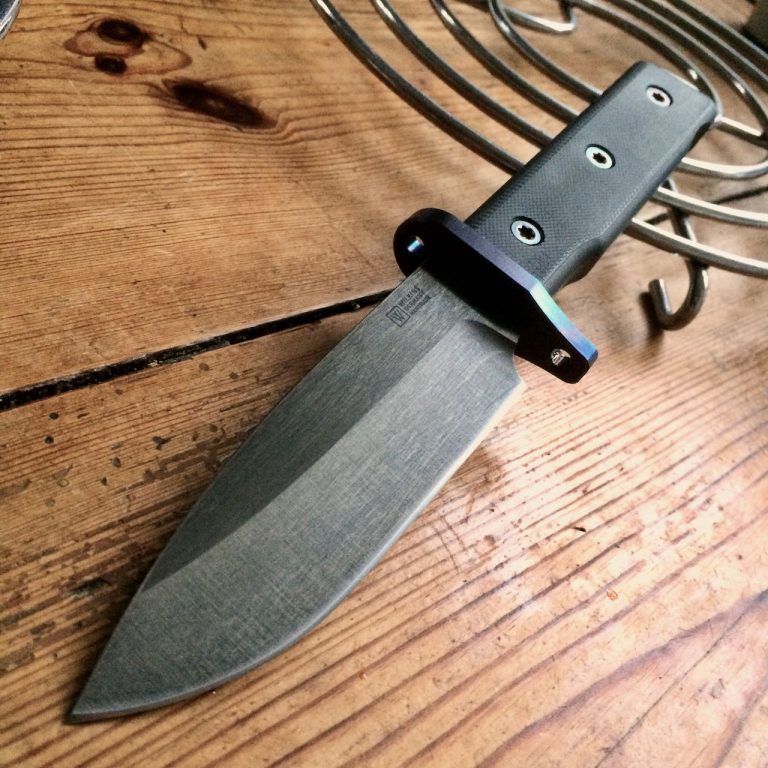
Identify the location of wooden surface. The height and width of the screenshot is (768, 768). (166, 247), (611, 588).